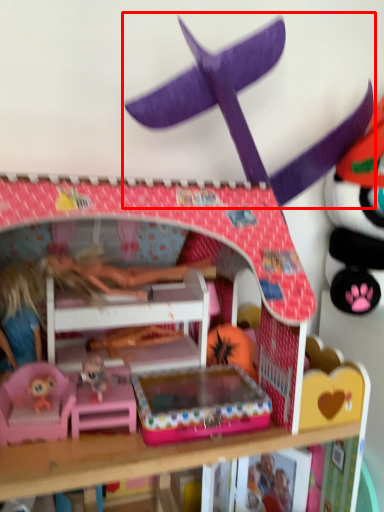
Question: Observing the image, what is the correct spatial positioning of toy (annotated by the red box) in reference to bunk bed?

Choices:
 (A) right
 (B) left

Answer: (A)